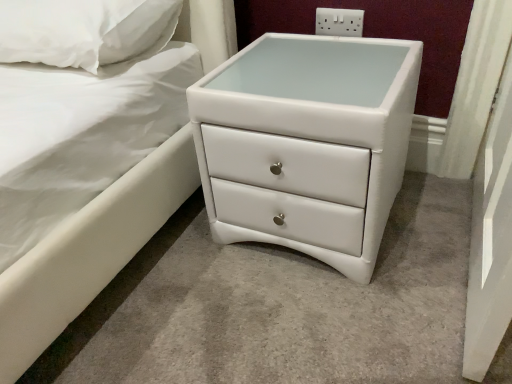
What is the approximate width of white plastic electrical outlet at upper center?

It is 0.68 inches.

Describe the element at coordinates (307, 143) in the screenshot. I see `white glossy chest of drawers at lower right` at that location.

What are the coordinates of `white soft pillow at upper left` in the screenshot? It's located at (83, 30).

In order to click on electric outlet on the right of white glossy chest of drawers at lower right in this screenshot , I will do `click(339, 22)`.

From the image's perspective, is white plastic electrical outlet at upper center located above or below white glossy chest of drawers at lower right?

white plastic electrical outlet at upper center is above white glossy chest of drawers at lower right.

From the picture: From a real-world perspective, relative to white glossy chest of drawers at lower right, is white plastic electrical outlet at upper center vertically above or below?

white plastic electrical outlet at upper center is above white glossy chest of drawers at lower right.

Is white plastic electrical outlet at upper center wider than white glossy chest of drawers at lower right?

No.

Are white soft pillow at upper left and white plastic electrical outlet at upper center making contact?

They are not placed beside each other.

Can we say white soft pillow at upper left lies outside white plastic electrical outlet at upper center?

white soft pillow at upper left lies outside white plastic electrical outlet at upper center's area.

Considering the sizes of objects white soft pillow at upper left and white plastic electrical outlet at upper center in the image provided, who is shorter, white soft pillow at upper left or white plastic electrical outlet at upper center?

Standing shorter between the two is white plastic electrical outlet at upper center.

How much distance is there between white soft pillow at upper left and white plastic electrical outlet at upper center?

white soft pillow at upper left is 25.76 inches from white plastic electrical outlet at upper center.

Is white soft pillow at upper left placed right next to white glossy chest of drawers at lower right?

No, white soft pillow at upper left is not making contact with white glossy chest of drawers at lower right.

Is white soft pillow at upper left oriented towards white glossy chest of drawers at lower right?

No, white soft pillow at upper left is not aimed at white glossy chest of drawers at lower right.

From the image's perspective, would you say white soft pillow at upper left is positioned over white glossy chest of drawers at lower right?

Yes, from the image's perspective, white soft pillow at upper left is on top of white glossy chest of drawers at lower right.

Can you confirm if white soft pillow at upper left is shorter than white glossy chest of drawers at lower right?

Indeed, white soft pillow at upper left has a lesser height compared to white glossy chest of drawers at lower right.

From a real-world perspective, which is physically below, white glossy chest of drawers at lower right or white plastic electrical outlet at upper center?

white glossy chest of drawers at lower right is physically lower.

Which of these two, white glossy chest of drawers at lower right or white plastic electrical outlet at upper center, stands shorter?

white plastic electrical outlet at upper center is shorter.

Would you say white glossy chest of drawers at lower right is a long distance from white plastic electrical outlet at upper center?

white glossy chest of drawers at lower right is actually quite close to white plastic electrical outlet at upper center.

Would you say white glossy chest of drawers at lower right is outside white plastic electrical outlet at upper center?

Yes, white glossy chest of drawers at lower right is not within white plastic electrical outlet at upper center.

From the image's perspective, which is below, white glossy chest of drawers at lower right or white soft pillow at upper left?

white glossy chest of drawers at lower right appears lower in the image.

Is white glossy chest of drawers at lower right looking in the opposite direction of white soft pillow at upper left?

No, white glossy chest of drawers at lower right is not facing away from white soft pillow at upper left.

Between white glossy chest of drawers at lower right and white soft pillow at upper left, which one has smaller size?

white soft pillow at upper left is smaller.

Looking at this image, who is shorter, white glossy chest of drawers at lower right or white soft pillow at upper left?

white soft pillow at upper left.

Considering the relative sizes of white plastic electrical outlet at upper center and white soft pillow at upper left in the image provided, is white plastic electrical outlet at upper center smaller than white soft pillow at upper left?

Yes, white plastic electrical outlet at upper center is smaller than white soft pillow at upper left.

Looking at this image, from a real-world perspective, between white plastic electrical outlet at upper center and white soft pillow at upper left, who is vertically higher?

In real-world perspective, white soft pillow at upper left is above.

Is white plastic electrical outlet at upper center next to white soft pillow at upper left?

No, white plastic electrical outlet at upper center is not beside white soft pillow at upper left.

From the image's perspective, is white plastic electrical outlet at upper center below white soft pillow at upper left?

Incorrect, from the image's perspective, white plastic electrical outlet at upper center is higher than white soft pillow at upper left.

Locate an element on the screen. electric outlet located behind the white glossy chest of drawers at lower right is located at coordinates (339, 22).

What are the coordinates of `pillow that is in front of the white plastic electrical outlet at upper center` in the screenshot? It's located at (83, 30).

Based on their spatial positions, is white soft pillow at upper left or white glossy chest of drawers at lower right closer to white plastic electrical outlet at upper center?

Among the two, white glossy chest of drawers at lower right is located nearer to white plastic electrical outlet at upper center.

Looking at the image, which one is located closer to white plastic electrical outlet at upper center, white glossy chest of drawers at lower right or white soft pillow at upper left?

white glossy chest of drawers at lower right.

From the picture: From the image, which object appears to be farther from white glossy chest of drawers at lower right, white soft pillow at upper left or white plastic electrical outlet at upper center?

white soft pillow at upper left is further to white glossy chest of drawers at lower right.

Looking at the image, which one is located further to white soft pillow at upper left, white plastic electrical outlet at upper center or white glossy chest of drawers at lower right?

white plastic electrical outlet at upper center lies further to white soft pillow at upper left than the other object.

From the image, which object appears to be nearer to white soft pillow at upper left, white glossy chest of drawers at lower right or white plastic electrical outlet at upper center?

Based on the image, white glossy chest of drawers at lower right appears to be nearer to white soft pillow at upper left.

Looking at the image, which one is located closer to white glossy chest of drawers at lower right, white plastic electrical outlet at upper center or white soft pillow at upper left?

white plastic electrical outlet at upper center.

Where is `chest of drawers between white soft pillow at upper left and white plastic electrical outlet at upper center from left to right`? The image size is (512, 384). chest of drawers between white soft pillow at upper left and white plastic electrical outlet at upper center from left to right is located at coordinates (307, 143).